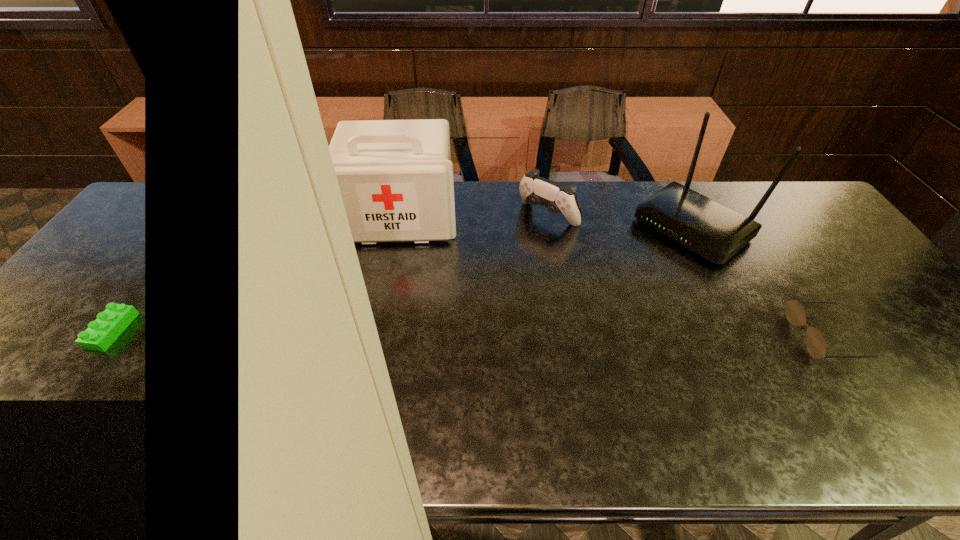
Where is `the shortest object`? the shortest object is located at coordinates (795, 313).

This screenshot has width=960, height=540. What are the coordinates of `the nearest object` in the screenshot? It's located at (795, 313).

Image resolution: width=960 pixels, height=540 pixels. Find the location of `the leftmost object`. the leftmost object is located at coordinates (395, 177).

Locate an element on the screen. Image resolution: width=960 pixels, height=540 pixels. control is located at coordinates click(x=535, y=190).

The image size is (960, 540). Find the location of `the third tallest object`. the third tallest object is located at coordinates (535, 190).

Where is `router`? router is located at coordinates click(x=715, y=232).

Image resolution: width=960 pixels, height=540 pixels. I want to click on vacant area located 0.260m on the front-facing side of the nearest object, so click(x=691, y=336).

The image size is (960, 540). Identify the location of vacant space situated on the front-facing side of the nearest object. (719, 336).

Find the location of a particular element. The image size is (960, 540). vacant space located 0.050m on the front-facing side of the nearest object is located at coordinates (777, 336).

Locate an element on the screen. Image resolution: width=960 pixels, height=540 pixels. vacant space located on the front-facing side of the leftmost object is located at coordinates pos(395,268).